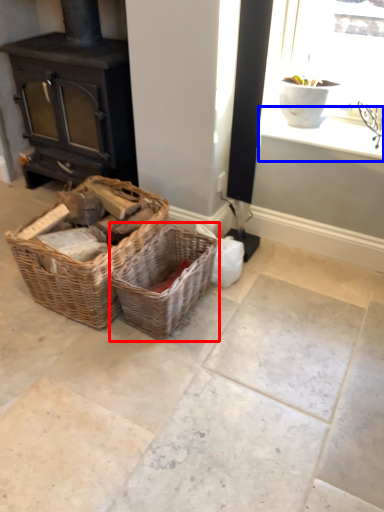
Question: Which of the following is the farthest to the observer, picnic basket (highlighted by a red box) or window sill (highlighted by a blue box)?

Choices:
 (A) picnic basket
 (B) window sill

Answer: (B)